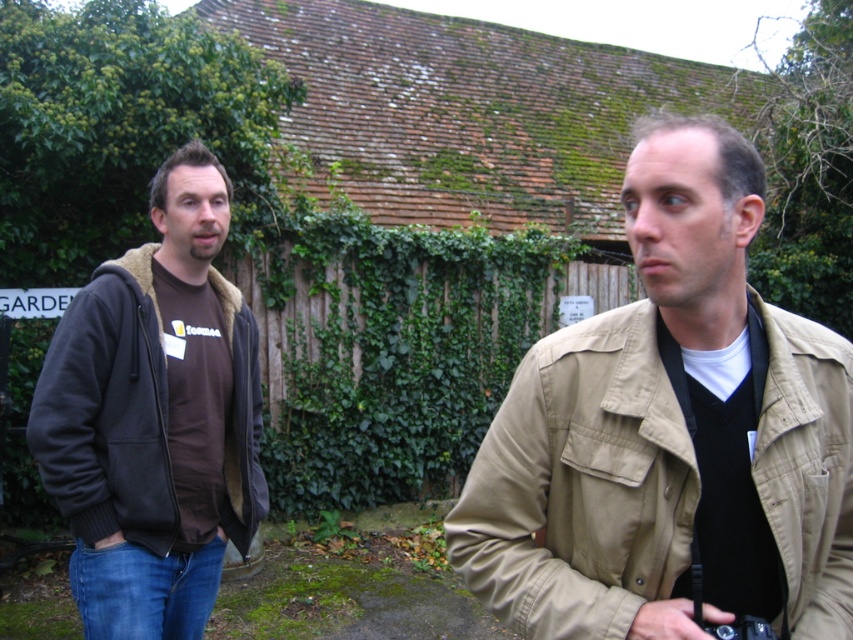
Which is behind, point (842, 488) or point (120, 467)?

The point (120, 467) is more distant.

Can you confirm if tan/cotton jacket at right is positioned above dark brown fleece jacket at left?

Incorrect, tan/cotton jacket at right is not positioned above dark brown fleece jacket at left.

Locate an element on the screen. Image resolution: width=853 pixels, height=640 pixels. tan/cotton jacket at right is located at coordinates pyautogui.click(x=579, y=484).